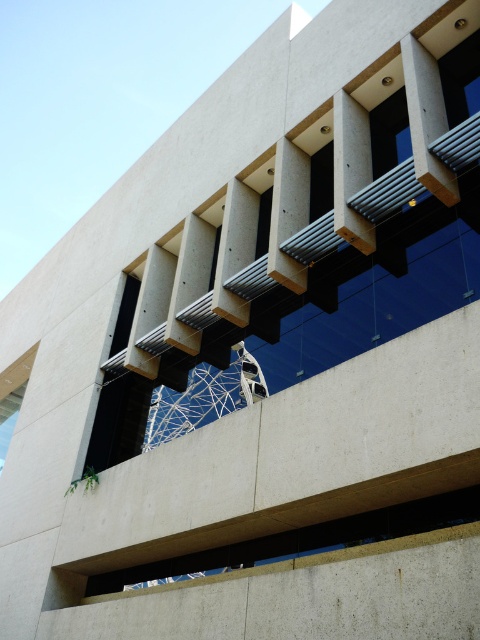
You are a GUI agent. You are given a task and a screenshot of the screen. Output one action in this format:
    pyautogui.click(x=<x>, y=<y>)
    Task: Click on the transparent glass window at upper right
    This screenshot has height=640, width=480.
    Given the screenshot: What is the action you would take?
    pyautogui.click(x=460, y=80)

Between transparent glass window at upper center and black glass window at upper left, which one is positioned lower?

black glass window at upper left

Is point (408, 156) more distant than point (116, 349)?

No, it is in front of (116, 349).

This screenshot has height=640, width=480. In order to click on transparent glass window at upper center in this screenshot , I will do `click(389, 132)`.

Is transparent glass window at upper center below transparent glass window at center?

No.

At what (x,y) coordinates should I click in order to perform the action: click on transparent glass window at upper center. Please return your answer as a coordinate pair (x, y). Image resolution: width=480 pixels, height=640 pixels. Looking at the image, I should click on [x=389, y=132].

Identify the location of transparent glass window at upper center. (389, 132).

Find the location of a particular element. The width and height of the screenshot is (480, 640). transparent glass window at upper center is located at coordinates (389, 132).